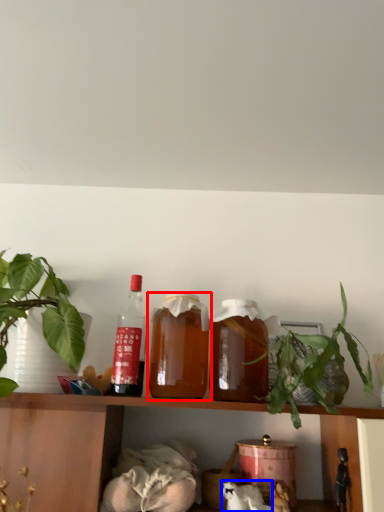
Question: Among these objects, which one is nearest to the camera, bottle (highlighted by a red box) or animal (highlighted by a blue box)?

Choices:
 (A) bottle
 (B) animal

Answer: (A)